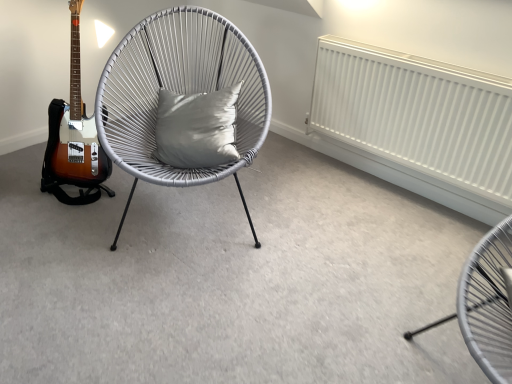
Question: Which is correct: white matte radiator at upper right is inside satin gray cushion at center, or outside of it?

Choices:
 (A) outside
 (B) inside

Answer: (A)

Question: Considering their positions, is white matte radiator at upper right located in front of or behind satin gray cushion at center?

Choices:
 (A) front
 (B) behind

Answer: (A)

Question: Considering the real-world distances, which object is farthest from the satin gray cushion at center?

Choices:
 (A) matte grey chair at lower right, the 1th chair positioned from the right
 (B) white woven chair at center, which is the first chair in back-to-front order
 (C) white matte radiator at upper right

Answer: (A)

Question: Estimate the real-world distances between objects in this image. Which object is closer to the satin gray cushion at center?

Choices:
 (A) matte grey chair at lower right, which is the 2th chair from left to right
 (B) white matte radiator at upper right
 (C) white woven chair at center, acting as the second chair starting from the right

Answer: (C)